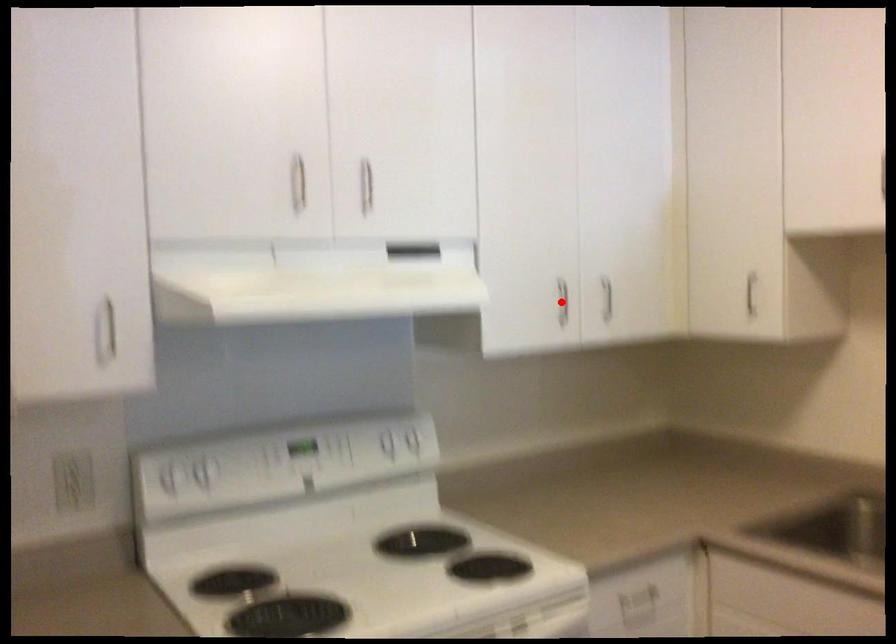
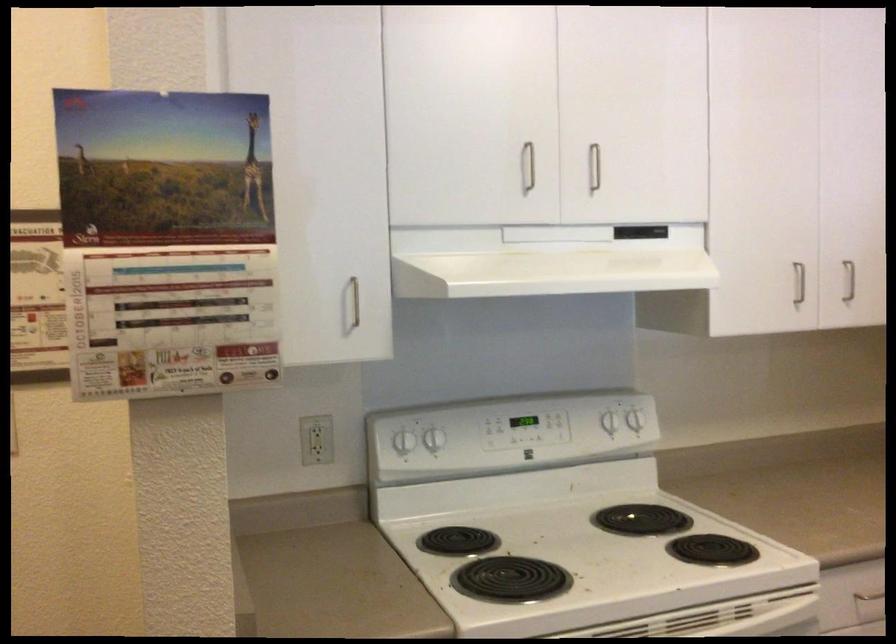
Locate, in the second image, the point that corresponds to the highlighted location in the first image.

(798, 283)